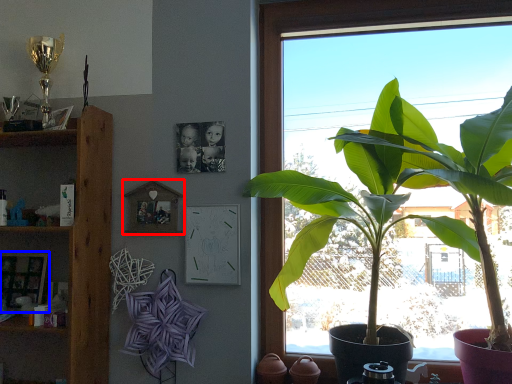
Question: Which object appears closest to the camera in this image, picture frame (highlighted by a red box) or picture frame (highlighted by a blue box)?

Choices:
 (A) picture frame
 (B) picture frame

Answer: (A)